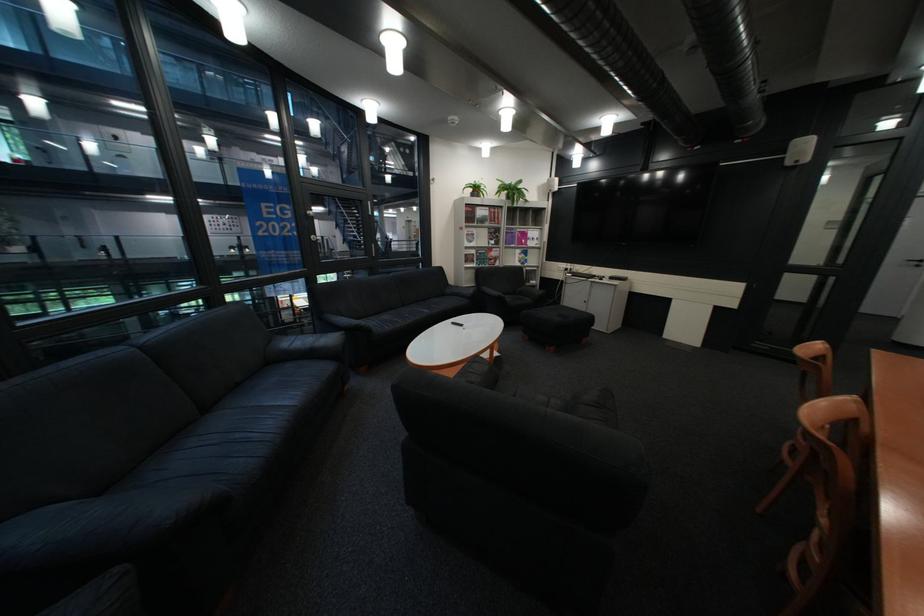
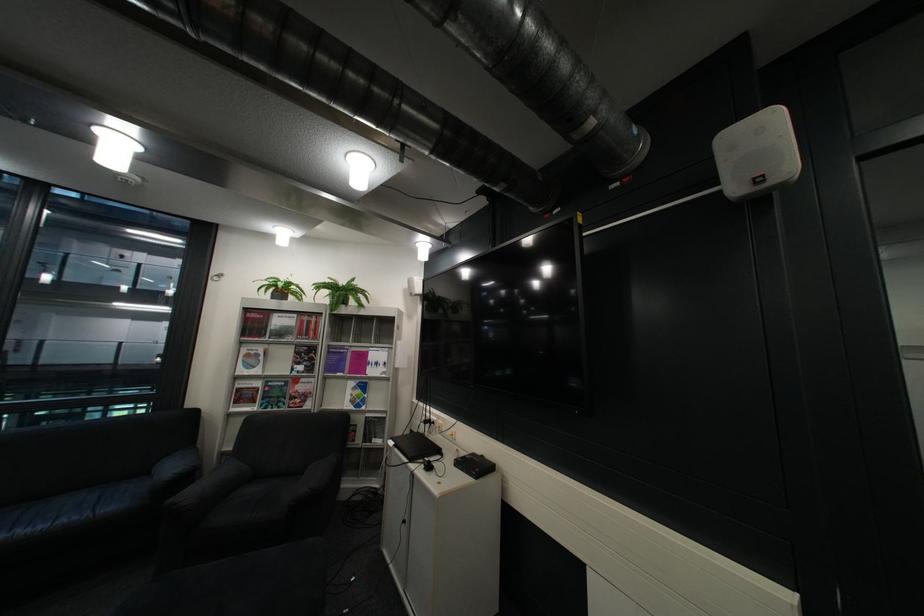
Locate, in the second image, the point that corresponds to point (497, 257) in the first image.

(290, 394)